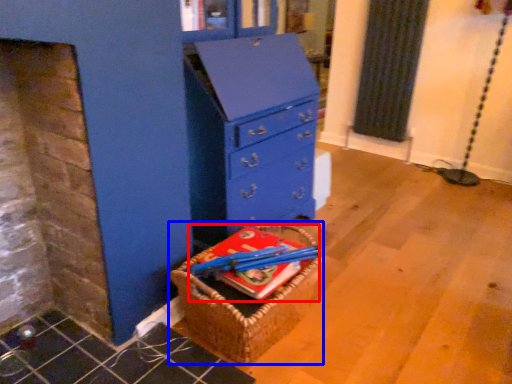
Question: Among these objects, which one is farthest to the camera, book (highlighted by a red box) or basket (highlighted by a blue box)?

Choices:
 (A) book
 (B) basket

Answer: (A)